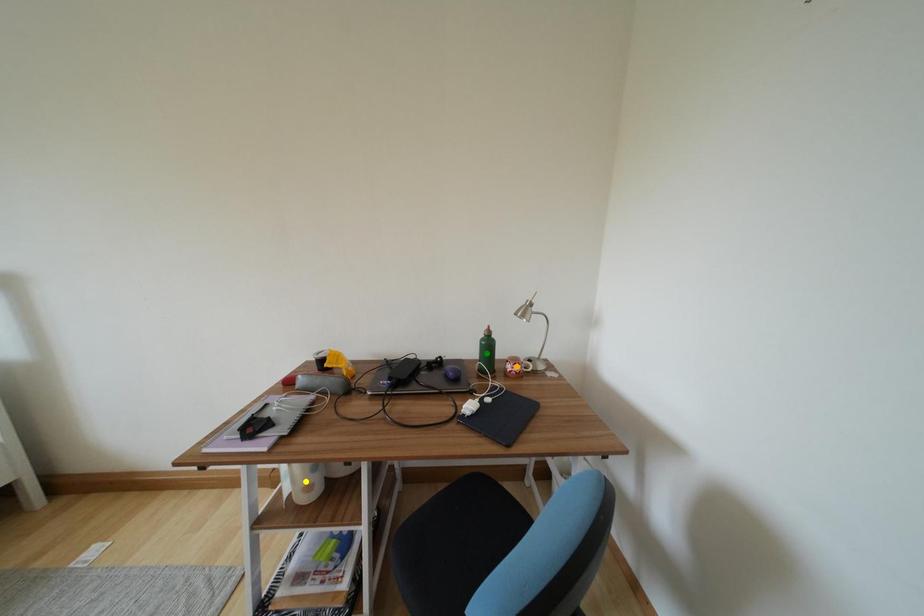
Order these from nearest to farthest:
- orange point
- green point
- yellow point

1. orange point
2. green point
3. yellow point